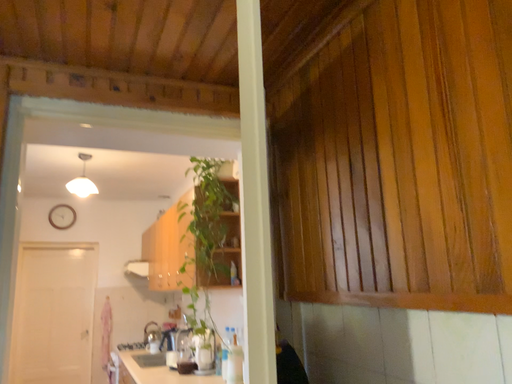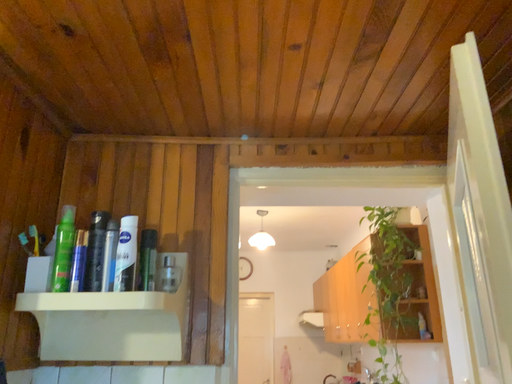
Question: Which way did the camera rotate in the video?

Choices:
 (A) rotated left
 (B) rotated right

Answer: (A)